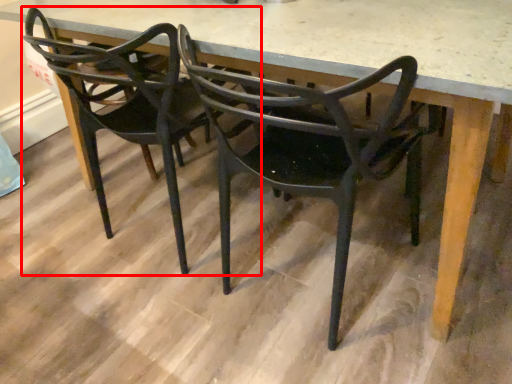
Question: In this image, where is chair (annotated by the red box) located relative to chair?

Choices:
 (A) right
 (B) left

Answer: (B)